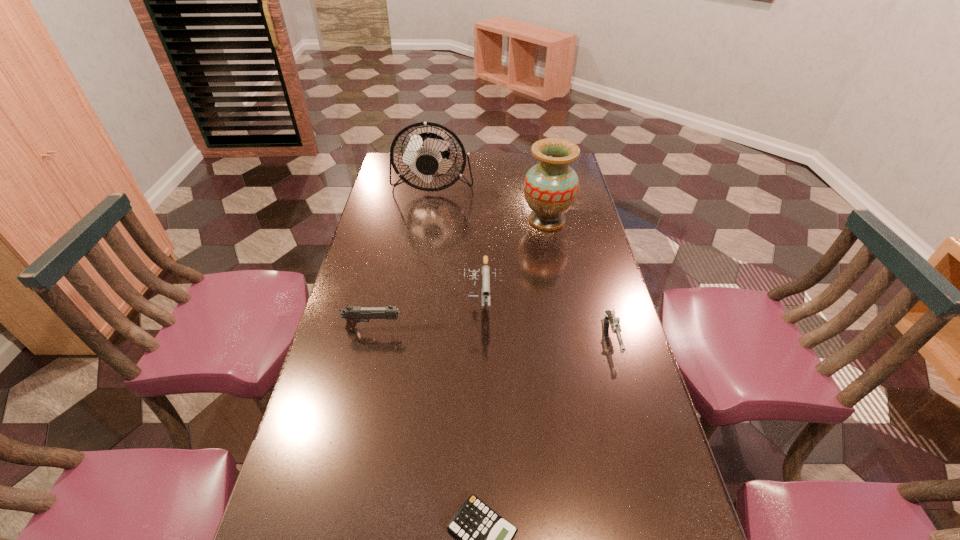
This screenshot has height=540, width=960. I want to click on blank space at the far edge of the desktop, so click(x=523, y=157).

You are a GUI agent. You are given a task and a screenshot of the screen. Output one action in this format:
    pyautogui.click(x=<x>, y=<y>)
    Task: Click on the free space at the left edge
    This screenshot has width=960, height=540.
    Given the screenshot: What is the action you would take?
    (x=366, y=401)

I want to click on free point at the right edge, so click(625, 523).

Find the location of a particular element. This screenshot has height=540, width=960. vacant space at the far left corner of the desktop is located at coordinates (398, 179).

Where is `unoccupied area between the fifth nearest object and the rightmost gun`? This screenshot has height=540, width=960. unoccupied area between the fifth nearest object and the rightmost gun is located at coordinates (580, 279).

Where is `empty space between the leftmost gun and the fourth shortest object`? empty space between the leftmost gun and the fourth shortest object is located at coordinates (427, 316).

Locate an element on the screen. free point between the second farthest object and the tallest gun is located at coordinates (514, 261).

This screenshot has height=540, width=960. Find the location of `vacant point located between the leftmost gun and the rightmost object`. vacant point located between the leftmost gun and the rightmost object is located at coordinates (493, 334).

You are a GUI agent. You are given a task and a screenshot of the screen. Output one action in this format:
    pyautogui.click(x=<x>, y=<y>)
    Task: Click on the empty space that is in between the vase and the rightmost gun
    
    Given the screenshot: What is the action you would take?
    (580, 279)

At what (x,y) coordinates should I click in order to perform the action: click on free space between the rightmost gun and the second gun from left to right. Please return your answer as a coordinate pair (x, y). The height and width of the screenshot is (540, 960). Looking at the image, I should click on (546, 319).